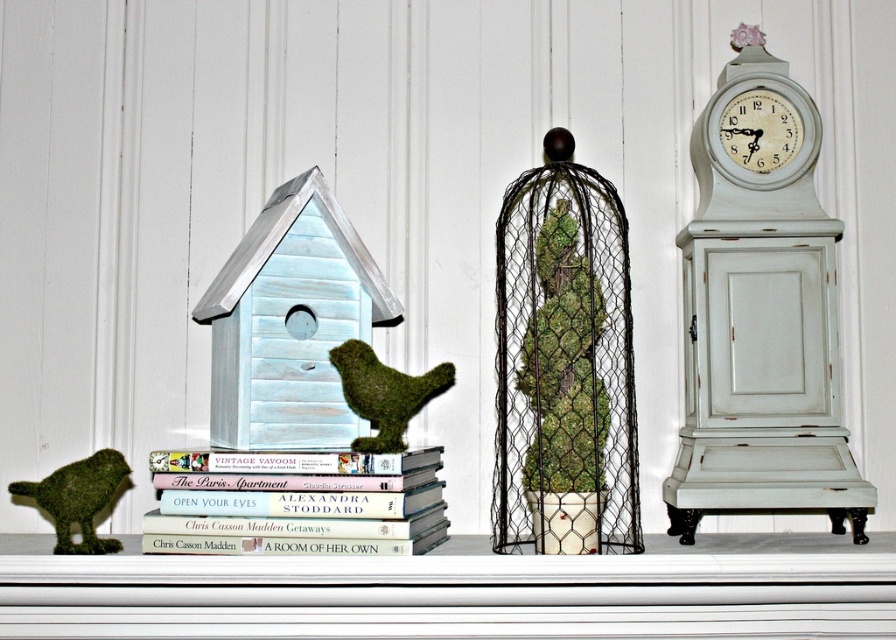
Question: Where is hardcover books at center located in relation to green moss bird at left in the image?

Choices:
 (A) above
 (B) below

Answer: (A)

Question: Which of the following is the closest to the observer?

Choices:
 (A) (265, 497)
 (B) (583, 378)

Answer: (A)

Question: Does white distressed wood clock at right appear on the left side of green moss bird at center?

Choices:
 (A) yes
 (B) no

Answer: (B)

Question: Which object is positioned closest to the wire mesh birdcage at center?

Choices:
 (A) white distressed wood clock at right
 (B) green moss bird at center
 (C) green moss bird at left

Answer: (A)

Question: Does white distressed wood clock at right have a larger size compared to green moss bird at center?

Choices:
 (A) no
 (B) yes

Answer: (B)

Question: Which is farther from the wire mesh birdcage at center?

Choices:
 (A) green moss bird at left
 (B) hardcover books at center
 (C) white distressed wood clock at right
 (D) green moss bird at center

Answer: (A)